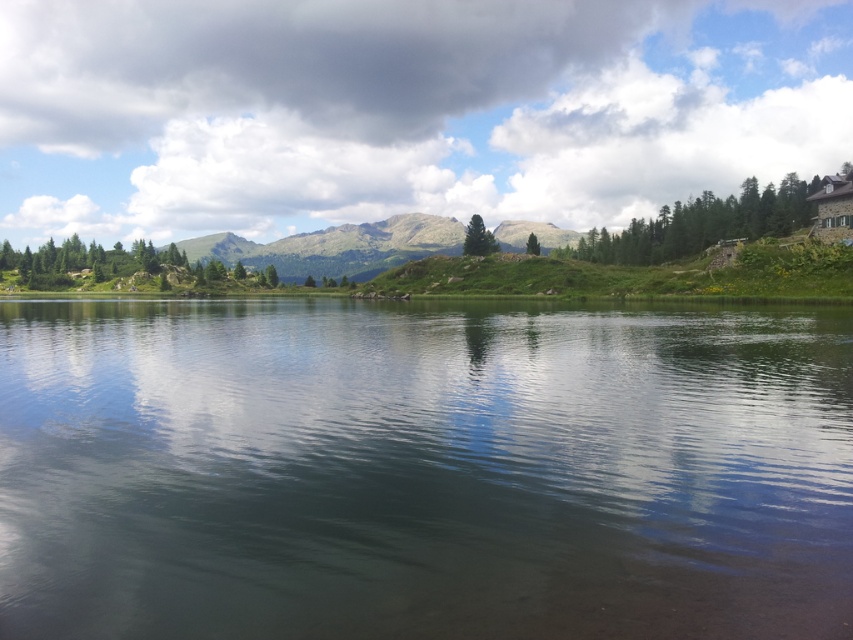
Question: Can you confirm if clear water at center is wider than green grassy hill at center?

Choices:
 (A) no
 (B) yes

Answer: (A)

Question: Is clear water at center positioned at the back of green grassy hill at center?

Choices:
 (A) no
 (B) yes

Answer: (A)

Question: Which point is farther to the camera?

Choices:
 (A) (338, 515)
 (B) (355, 275)

Answer: (B)

Question: In this image, where is clear water at center located relative to green grassy hill at center?

Choices:
 (A) left
 (B) right

Answer: (B)